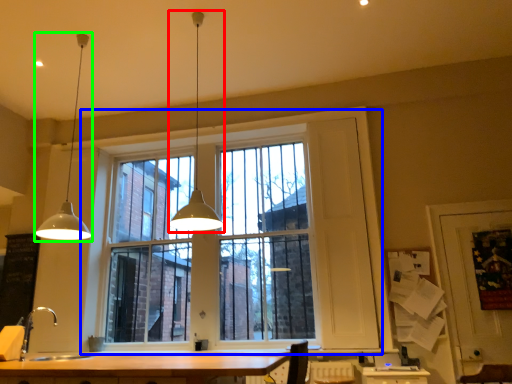
Question: Based on their relative distances, which object is farther from lamp (highlighted by a red box)? Choose from window (highlighted by a blue box) and lamp (highlighted by a green box).

Choices:
 (A) window
 (B) lamp

Answer: (A)